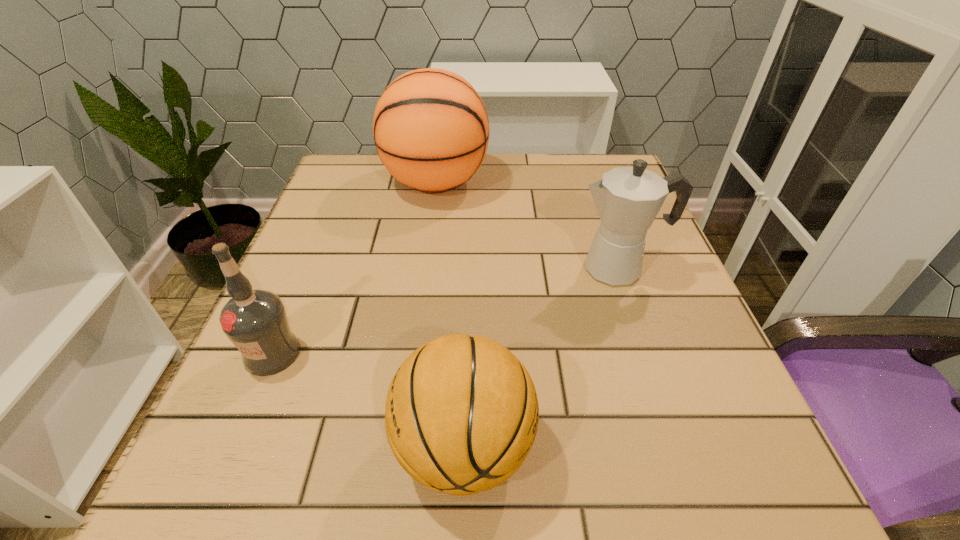
Locate an element on the screen. empty space that is in between the nearest object and the farther basketball is located at coordinates (450, 315).

The image size is (960, 540). I want to click on free space between the farthest object and the leftmost object, so click(x=354, y=268).

Locate an element on the screen. empty space between the nearest object and the farther basketball is located at coordinates (x=450, y=315).

Where is `vacant point located between the shorter basketball and the coffeepot`? This screenshot has width=960, height=540. vacant point located between the shorter basketball and the coffeepot is located at coordinates (540, 358).

Where is `free spot between the shorter basketball and the farthest object`? This screenshot has height=540, width=960. free spot between the shorter basketball and the farthest object is located at coordinates (450, 315).

Image resolution: width=960 pixels, height=540 pixels. Find the location of `empty space between the third nearest object and the vodka`. empty space between the third nearest object and the vodka is located at coordinates (445, 311).

At what (x,y) coordinates should I click in order to perform the action: click on object that stands as the closest to the second farthest object. Please return your answer as a coordinate pair (x, y). This screenshot has width=960, height=540. Looking at the image, I should click on (431, 130).

Identify which object is the second closest to the rightmost object. Please provide its 2D coordinates. Your answer should be formatted as a tuple, i.e. [(x, y)], where the tuple contains the x and y coordinates of a point satisfying the conditions above.

[(461, 415)]